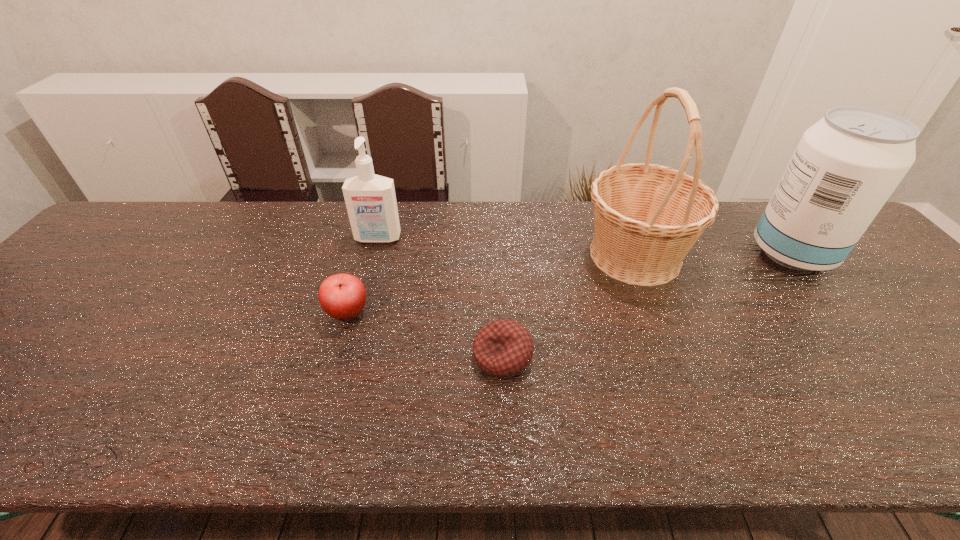
The width and height of the screenshot is (960, 540). In order to click on free space between the tallest object and the third shortest object in this screenshot , I will do pos(507,247).

Find the location of a particular element. free spot between the third shortest object and the basket is located at coordinates (507, 247).

The width and height of the screenshot is (960, 540). What are the coordinates of `empty space between the second nearest object and the cleansing agent` in the screenshot? It's located at (363, 275).

Where is `free space between the third shortest object and the fourth object from left to right`? free space between the third shortest object and the fourth object from left to right is located at coordinates (507, 247).

Where is `the closest object to the alcohol`? the closest object to the alcohol is located at coordinates (647, 217).

Select which object appears as the closest to the apple. Please provide its 2D coordinates. Your answer should be formatted as a tuple, i.e. [(x, y)], where the tuple contains the x and y coordinates of a point satisfying the conditions above.

[(370, 199)]

At what (x,y) coordinates should I click in order to perform the action: click on free spot that satisfies the following two spatial constraints: 1. on the back side of the rightmost object; 2. on the right side of the second nearest object. Please return your answer as a coordinate pair (x, y). Looking at the image, I should click on (365, 253).

Where is `free space that satisfies the following two spatial constraints: 1. on the front label of the third tallest object; 2. on the left side of the second object from right to left`? This screenshot has width=960, height=540. free space that satisfies the following two spatial constraints: 1. on the front label of the third tallest object; 2. on the left side of the second object from right to left is located at coordinates 373,255.

Image resolution: width=960 pixels, height=540 pixels. I want to click on free space that satisfies the following two spatial constraints: 1. on the front label of the cleansing agent; 2. on the right side of the alcohol, so click(x=374, y=253).

Image resolution: width=960 pixels, height=540 pixels. Identify the location of vacant region that satisfies the following two spatial constraints: 1. on the front label of the alcohol; 2. on the left side of the cleansing agent. (374, 253).